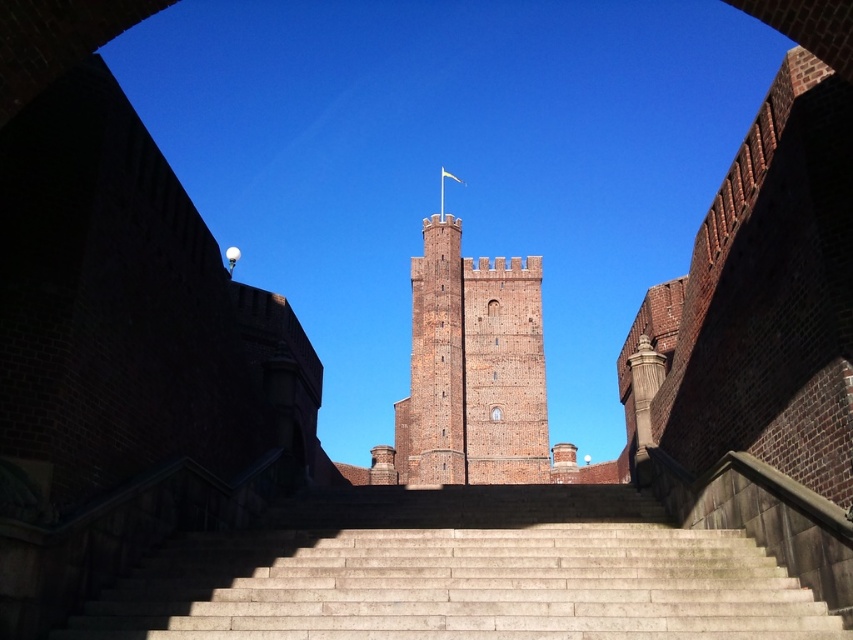
Is point (506, 518) farther from camera compared to point (459, 340)?

No, it is not.

What do you see at coordinates (460, 573) in the screenshot?
I see `smooth stone stairs at center` at bounding box center [460, 573].

What are the coordinates of `smooth stone stairs at center` in the screenshot? It's located at coord(460,573).